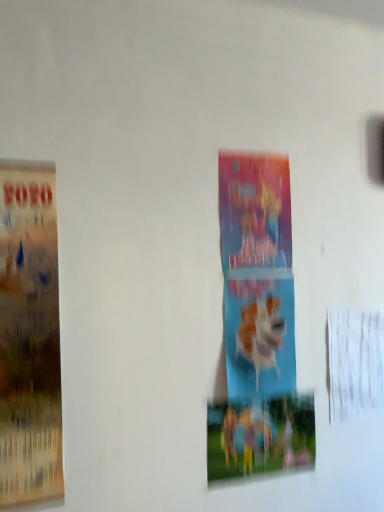
What do you see at coordinates (260, 437) in the screenshot? I see `colorful paper poster at center, which appears as the second poster when viewed from the front` at bounding box center [260, 437].

Locate an element on the screen. matte paper poster at left, which is counted as the first poster, starting from the left is located at coordinates (29, 335).

Is point (41, 205) closer to camera compared to point (274, 298)?

Yes, it is in front of point (274, 298).

Considering the sizes of objects matte paper poster at left, which appears as the 1th poster when viewed from the front, and blue matte dog at center in the image provided, who is thinner, matte paper poster at left, which appears as the 1th poster when viewed from the front, or blue matte dog at center?

blue matte dog at center is thinner.

Are matte paper poster at left, which appears as the 1th poster when viewed from the front, and blue matte dog at center far apart?

Actually, matte paper poster at left, which appears as the 1th poster when viewed from the front, and blue matte dog at center are a little close together.

From their relative heights in the image, would you say matte paper poster at left, which appears as the 1th poster when viewed from the front, is taller or shorter than blue matte dog at center?

Clearly, matte paper poster at left, which appears as the 1th poster when viewed from the front, is taller compared to blue matte dog at center.

Which is more to the right, colorful paper poster at center, which is the 1th poster in back-to-front order, or matte paper poster at left, which appears as the 1th poster when viewed from the front?

colorful paper poster at center, which is the 1th poster in back-to-front order, is more to the right.

Image resolution: width=384 pixels, height=512 pixels. I want to click on poster above the colorful paper poster at center, the first poster from the right (from the image's perspective), so click(29, 335).

Can you confirm if colorful paper poster at center, which appears as the second poster when viewed from the front, is taller than matte paper poster at left, which is the second poster from right to left?

No, colorful paper poster at center, which appears as the second poster when viewed from the front, is not taller than matte paper poster at left, which is the second poster from right to left.

Based on the photo, who is more distant, colorful paper poster at center, which appears as the second poster when viewed from the front, or matte paper poster at left, which is the second poster from right to left?

Positioned behind is colorful paper poster at center, which appears as the second poster when viewed from the front.

Does point (291, 466) lie in front of point (257, 340)?

No, (291, 466) is further to viewer.

Is colorful paper poster at center, which is the 1th poster in back-to-front order, further to the viewer compared to blue matte dog at center?

No, colorful paper poster at center, which is the 1th poster in back-to-front order, is closer to the viewer.

Is colorful paper poster at center, marked as the 2th poster in a left-to-right arrangement, next to blue matte dog at center and touching it?

No, colorful paper poster at center, marked as the 2th poster in a left-to-right arrangement, is not beside blue matte dog at center.

From the picture: Between colorful paper poster at center, which is the 1th poster in back-to-front order, and blue matte dog at center, which one has smaller size?

colorful paper poster at center, which is the 1th poster in back-to-front order, is smaller.

Which object is more forward, blue matte dog at center or colorful paper poster at center, marked as the 2th poster in a left-to-right arrangement?

colorful paper poster at center, marked as the 2th poster in a left-to-right arrangement.

Is blue matte dog at center oriented towards colorful paper poster at center, the first poster from the right?

No, blue matte dog at center is not aimed at colorful paper poster at center, the first poster from the right.

Does blue matte dog at center have a greater height compared to colorful paper poster at center, the first poster from the right?

Yes.

Could colorful paper poster at center, the first poster from the right, be considered to be inside matte paper poster at left, which is the second poster in back-to-front order?

Definitely not — colorful paper poster at center, the first poster from the right, is not inside matte paper poster at left, which is the second poster in back-to-front order.

From the image's perspective, does matte paper poster at left, which is the second poster in back-to-front order, appear lower than colorful paper poster at center, which is the 1th poster in back-to-front order?

Incorrect, from the image's perspective, matte paper poster at left, which is the second poster in back-to-front order, is higher than colorful paper poster at center, which is the 1th poster in back-to-front order.

How different are the orientations of matte paper poster at left, which is the second poster from right to left, and colorful paper poster at center, the first poster from the right, in degrees?

1.45 degrees.

Which object is further away from the camera, matte paper poster at left, which is the second poster from right to left, or colorful paper poster at center, which appears as the second poster when viewed from the front?

colorful paper poster at center, which appears as the second poster when viewed from the front, is further from the camera.

How far apart are blue matte dog at center and matte paper poster at left, which is counted as the first poster, starting from the left?

blue matte dog at center and matte paper poster at left, which is counted as the first poster, starting from the left, are 27.44 inches apart.

Looking at this image, can you confirm if blue matte dog at center is positioned to the right of matte paper poster at left, which appears as the 1th poster when viewed from the front?

Indeed, blue matte dog at center is positioned on the right side of matte paper poster at left, which appears as the 1th poster when viewed from the front.

From the picture: Is blue matte dog at center directly adjacent to matte paper poster at left, which appears as the 1th poster when viewed from the front?

blue matte dog at center is not next to matte paper poster at left, which appears as the 1th poster when viewed from the front, and they're not touching.

Is blue matte dog at center situated inside matte paper poster at left, which is the second poster from right to left, or outside?

blue matte dog at center is located beyond the bounds of matte paper poster at left, which is the second poster from right to left.

Image resolution: width=384 pixels, height=512 pixels. I want to click on animal that appears behind the matte paper poster at left, which is counted as the first poster, starting from the left, so click(261, 334).

This screenshot has width=384, height=512. I want to click on poster above the colorful paper poster at center, marked as the 2th poster in a left-to-right arrangement (from the image's perspective), so click(29, 335).

When comparing their distances from matte paper poster at left, which appears as the 1th poster when viewed from the front, does colorful paper poster at center, which appears as the second poster when viewed from the front, or blue matte dog at center seem closer?

colorful paper poster at center, which appears as the second poster when viewed from the front.

From the image, which object appears to be nearer to matte paper poster at left, which is the second poster from right to left, blue matte dog at center or colorful paper poster at center, marked as the 2th poster in a left-to-right arrangement?

The object closer to matte paper poster at left, which is the second poster from right to left, is colorful paper poster at center, marked as the 2th poster in a left-to-right arrangement.

Considering their positions, is matte paper poster at left, which is the second poster from right to left, positioned further to colorful paper poster at center, marked as the 2th poster in a left-to-right arrangement, than blue matte dog at center?

The object further to colorful paper poster at center, marked as the 2th poster in a left-to-right arrangement, is matte paper poster at left, which is the second poster from right to left.

When comparing their distances from colorful paper poster at center, which is the 1th poster in back-to-front order, does blue matte dog at center or matte paper poster at left, which is the second poster from right to left, seem further?

matte paper poster at left, which is the second poster from right to left.

From the image, which object appears to be nearer to blue matte dog at center, colorful paper poster at center, which appears as the second poster when viewed from the front, or matte paper poster at left, which is counted as the first poster, starting from the left?

colorful paper poster at center, which appears as the second poster when viewed from the front, is closer to blue matte dog at center.

When comparing their distances from blue matte dog at center, does matte paper poster at left, which is counted as the first poster, starting from the left, or colorful paper poster at center, the first poster from the right, seem further?

matte paper poster at left, which is counted as the first poster, starting from the left, is positioned further to the anchor blue matte dog at center.

Where is `poster situated between matte paper poster at left, which is counted as the first poster, starting from the left, and blue matte dog at center from left to right`? poster situated between matte paper poster at left, which is counted as the first poster, starting from the left, and blue matte dog at center from left to right is located at coordinates (260, 437).